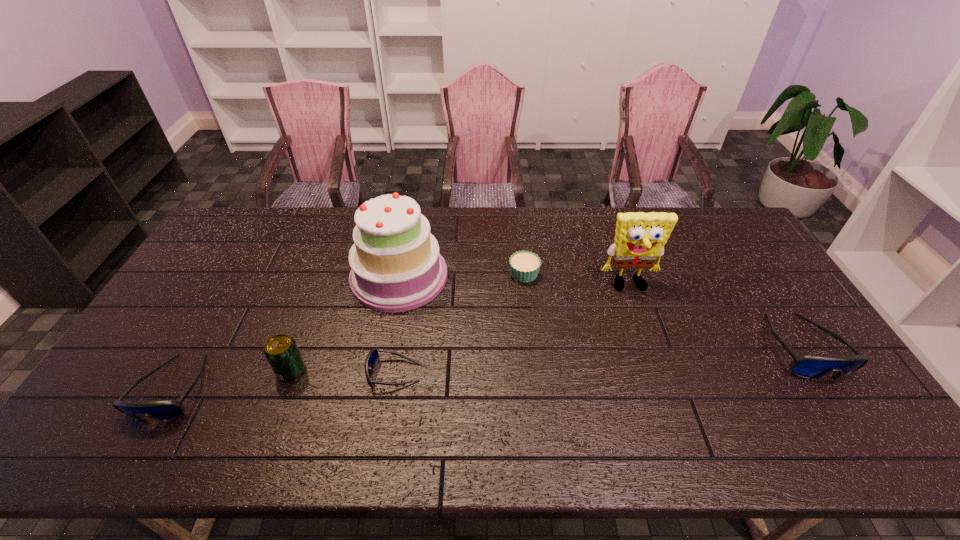
Where is `object at the near left corner`? Image resolution: width=960 pixels, height=540 pixels. object at the near left corner is located at coordinates (164, 410).

This screenshot has height=540, width=960. I want to click on object that is at the near right corner, so click(x=808, y=366).

Where is `vacant space at the far edge of the desktop`? Image resolution: width=960 pixels, height=540 pixels. vacant space at the far edge of the desktop is located at coordinates (537, 232).

In the image, there is a desktop. Identify the location of vacant space at the near edge. (715, 404).

Where is `vacant area at the left edge`? vacant area at the left edge is located at coordinates (138, 370).

Where is `free spot at the right edge of the desktop`? free spot at the right edge of the desktop is located at coordinates (721, 265).

Find the location of a particular element. The height and width of the screenshot is (540, 960). vacant space that is in between the beer can and the leftmost sunglasses is located at coordinates (232, 379).

Where is `vacant region between the beer can and the fifth tallest object`? The height and width of the screenshot is (540, 960). vacant region between the beer can and the fifth tallest object is located at coordinates [232, 379].

Find the location of `free point between the cake and the leftmost object`. free point between the cake and the leftmost object is located at coordinates (286, 332).

The height and width of the screenshot is (540, 960). What are the coordinates of `free area in between the rightmost object and the cake` in the screenshot? It's located at (600, 311).